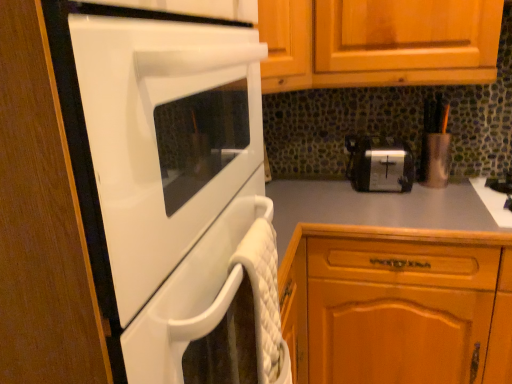
Question: Is point tap(219, 170) closer or farther from the camera than point tap(498, 213)?

Choices:
 (A) farther
 (B) closer

Answer: (B)

Question: Visually, is white glossy oven at left positioned to the left or to the right of black matte gas stove at right?

Choices:
 (A) right
 (B) left

Answer: (B)

Question: Estimate the real-world distances between objects in this image. Which object is closer to the black matte gas stove at right?

Choices:
 (A) white glossy oven at left
 (B) wooden cabinet at lower right
 (C) silver metallic toaster at center

Answer: (C)

Question: Estimate the real-world distances between objects in this image. Which object is farther from the silver metallic toaster at center?

Choices:
 (A) black matte gas stove at right
 (B) wooden cabinet at lower right
 (C) white glossy oven at left

Answer: (C)